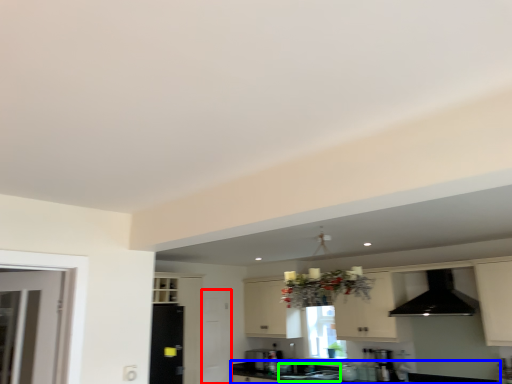
Question: Which object is positioned closest to screen door (highlighted by a red box)? Select from countertop (highlighted by a blue box) and sink (highlighted by a green box).

Choices:
 (A) countertop
 (B) sink

Answer: (A)